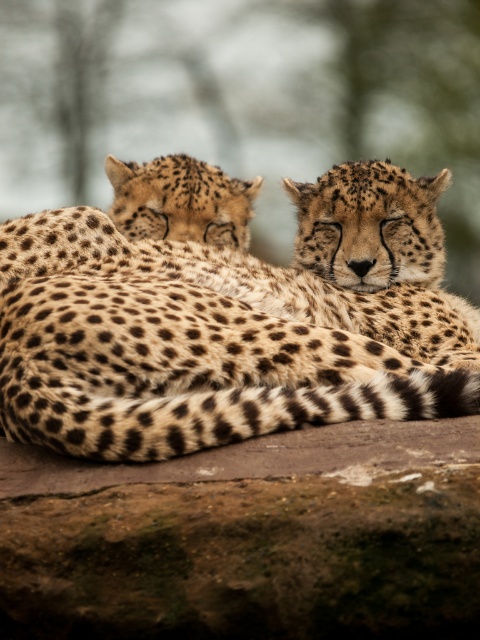
Question: Does spotted fur cheetah at center have a larger size compared to spotted fur cheetah at upper left?

Choices:
 (A) no
 (B) yes

Answer: (B)

Question: Does spotted fur cheetah at center have a lesser width compared to brown rough boulder at lower center?

Choices:
 (A) no
 (B) yes

Answer: (A)

Question: Which object appears farthest from the camera in this image?

Choices:
 (A) spotted fur cheetah at upper left
 (B) brown rough boulder at lower center
 (C) spotted fur cheetah at center

Answer: (A)

Question: Which point is closer to the camera?

Choices:
 (A) (196, 236)
 (B) (310, 221)
 (C) (132, 476)

Answer: (C)

Question: Estimate the real-world distances between objects in this image. Which object is farther from the spotted fur cheetah at center?

Choices:
 (A) spotted fur cheetah at upper left
 (B) brown rough boulder at lower center

Answer: (A)

Question: Can you confirm if spotted fur cheetah at center is thinner than brown rough boulder at lower center?

Choices:
 (A) no
 (B) yes

Answer: (A)